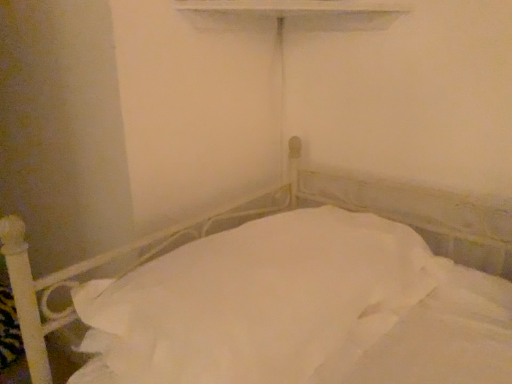
Question: Is white painted wood at upper center inside the boundaries of white fabric bed at center, or outside?

Choices:
 (A) inside
 (B) outside

Answer: (B)

Question: Visually, is white painted wood at upper center positioned to the left or to the right of white fabric bed at center?

Choices:
 (A) left
 (B) right

Answer: (B)

Question: From the image's perspective, is white painted wood at upper center positioned above or below white fabric bed at center?

Choices:
 (A) below
 (B) above

Answer: (B)

Question: From a real-world perspective, is white fabric bed at center physically located above or below white painted wood at upper center?

Choices:
 (A) below
 (B) above

Answer: (A)

Question: Considering the positions of white fabric bed at center and white painted wood at upper center in the image, is white fabric bed at center wider or thinner than white painted wood at upper center?

Choices:
 (A) thin
 (B) wide

Answer: (B)

Question: Does point (453, 248) appear closer or farther from the camera than point (334, 18)?

Choices:
 (A) closer
 (B) farther

Answer: (A)

Question: Choose the correct answer: Is white fabric bed at center inside white painted wood at upper center or outside it?

Choices:
 (A) outside
 (B) inside

Answer: (A)